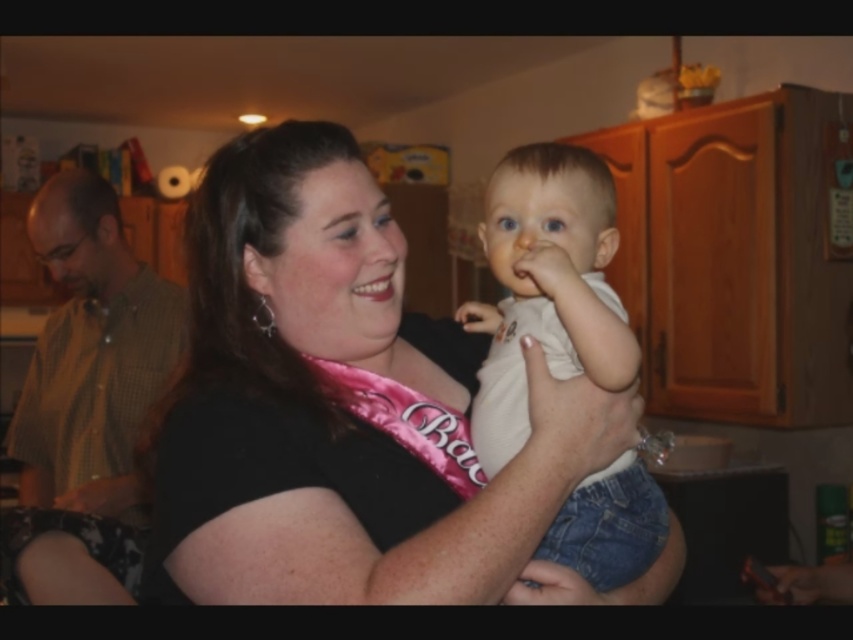
Question: Does black satin sash at center appear on the left side of white cotton shirt at center?

Choices:
 (A) yes
 (B) no

Answer: (A)

Question: Is the position of black satin sash at center less distant than that of green checkered shirt at left?

Choices:
 (A) yes
 (B) no

Answer: (A)

Question: Considering the real-world distances, which object is closest to the black satin sash at center?

Choices:
 (A) green checkered shirt at left
 (B) white cotton shirt at center

Answer: (B)

Question: Considering the real-world distances, which object is closest to the black satin sash at center?

Choices:
 (A) white cotton shirt at center
 (B) green checkered shirt at left

Answer: (A)

Question: Does black satin sash at center appear under white cotton shirt at center?

Choices:
 (A) no
 (B) yes

Answer: (B)

Question: Which of the following is the farthest from the observer?

Choices:
 (A) green checkered shirt at left
 (B) white cotton shirt at center
 (C) black satin sash at center

Answer: (A)